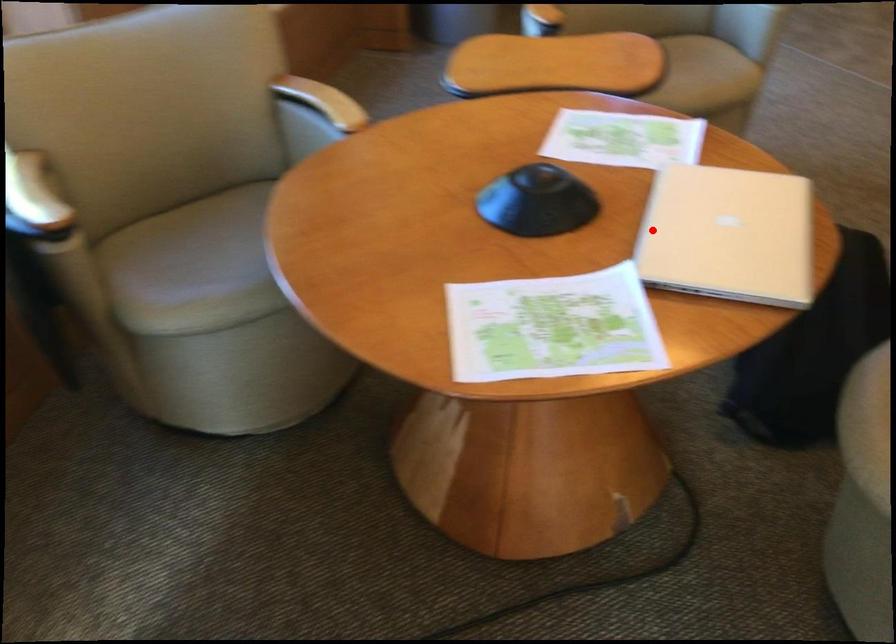
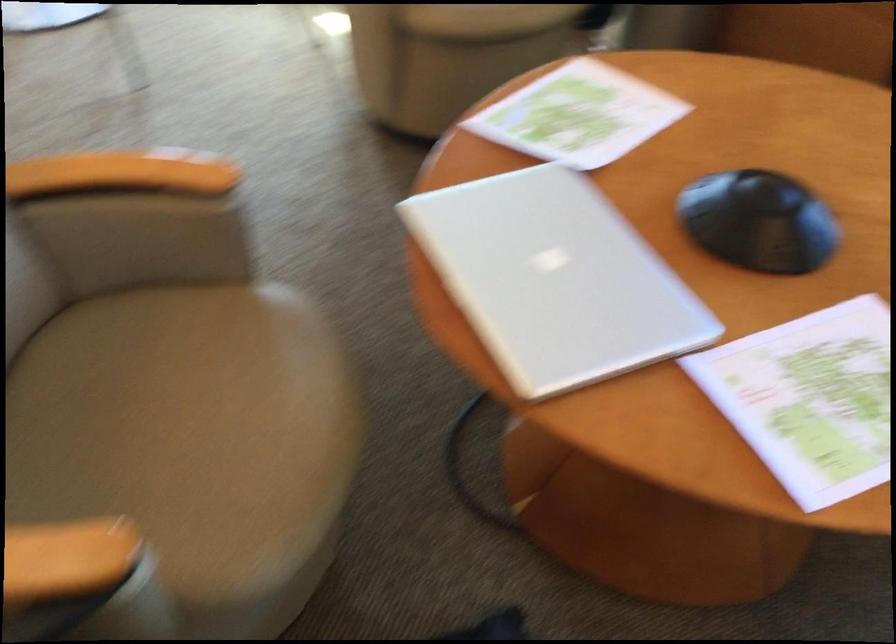
Question: I am providing you with two images of the same scene from different viewpoints. A red point is shown in image1. For the corresponding object point in image2, is it positioned nearer or farther from the camera?

Choices:
 (A) Nearer
 (B) Farther

Answer: (A)